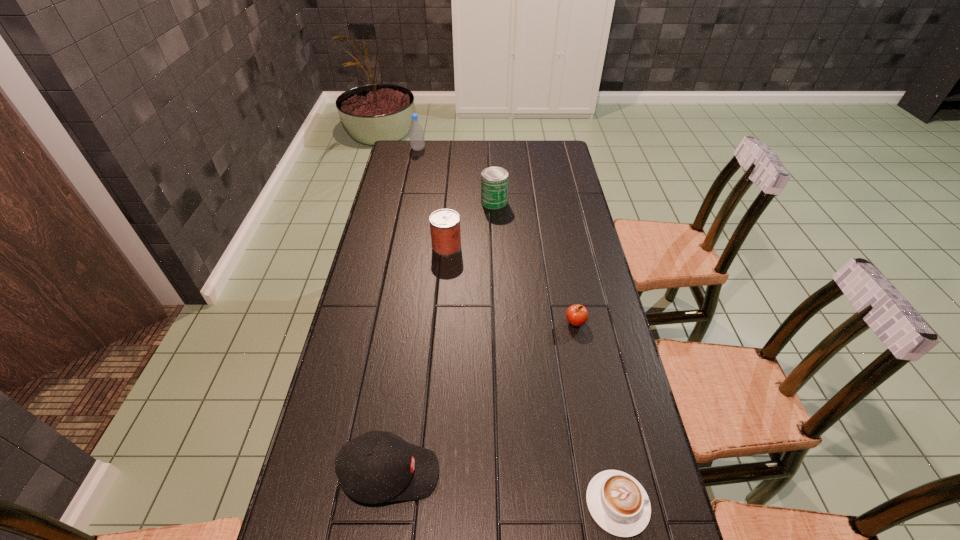
Identify the location of object that is at the far left corner. (416, 133).

Where is `free region at the far edge of the desktop`? The image size is (960, 540). free region at the far edge of the desktop is located at coordinates (510, 148).

You are a GUI agent. You are given a task and a screenshot of the screen. Output one action in this format:
    pyautogui.click(x=<x>, y=<y>)
    Task: Click on the free space at the left edge of the desktop
    The image size is (960, 540).
    Given the screenshot: What is the action you would take?
    (x=365, y=307)

Where is `free space at the right edge`? Image resolution: width=960 pixels, height=540 pixels. free space at the right edge is located at coordinates point(607,411).

Locate an element on the screen. vacant space at the far left corner is located at coordinates (399, 150).

The height and width of the screenshot is (540, 960). I want to click on vacant point located between the baseball cap and the right can, so click(x=443, y=338).

You are a GUI agent. You are given a task and a screenshot of the screen. Output one action in this format:
    pyautogui.click(x=<x>, y=<y>)
    Task: Click on the free area in between the fourth farthest object and the nearer can
    
    Given the screenshot: What is the action you would take?
    pyautogui.click(x=511, y=284)

Identify the location of free space between the baseball cap and the farther can. (443, 338).

Locate an element on the screen. This screenshot has width=960, height=540. free spot between the fifth tallest object and the shortest object is located at coordinates coord(596,413).

The image size is (960, 540). Identify the location of vacant space that's between the baseball cap and the shortest object. (504, 488).